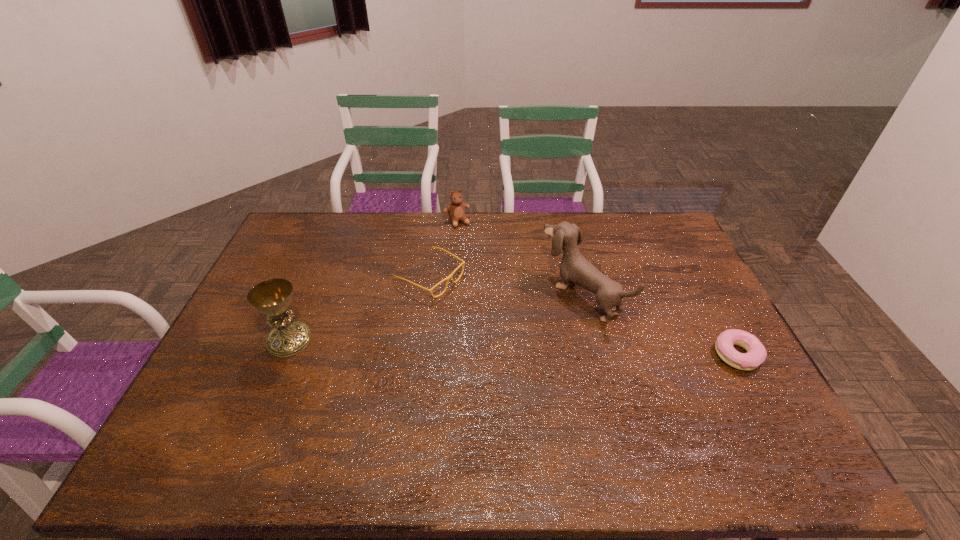
Locate an element on the screen. free area in between the doughnut and the leftmost object is located at coordinates (514, 348).

This screenshot has height=540, width=960. What are the coordinates of `vacant area between the doughnut and the spectacles` in the screenshot? It's located at (584, 316).

Where is `vacant space in between the puppy and the leftmost object`? The image size is (960, 540). vacant space in between the puppy and the leftmost object is located at coordinates (435, 318).

Locate an element on the screen. The width and height of the screenshot is (960, 540). vacant space that's between the spectacles and the puppy is located at coordinates (506, 286).

Image resolution: width=960 pixels, height=540 pixels. I want to click on vacant space in between the rightmost object and the spectacles, so click(x=584, y=316).

Locate which object is the closest to the chalice. Please provide its 2D coordinates. Your answer should be formatted as a tuple, i.e. [(x, y)], where the tuple contains the x and y coordinates of a point satisfying the conditions above.

[(463, 262)]

This screenshot has width=960, height=540. What are the coordinates of `object that ranks as the second closest to the puppy` in the screenshot? It's located at (463, 262).

Locate an element on the screen. free space that satisfies the following two spatial constraints: 1. on the back side of the spectacles; 2. on the right side of the chalice is located at coordinates (316, 278).